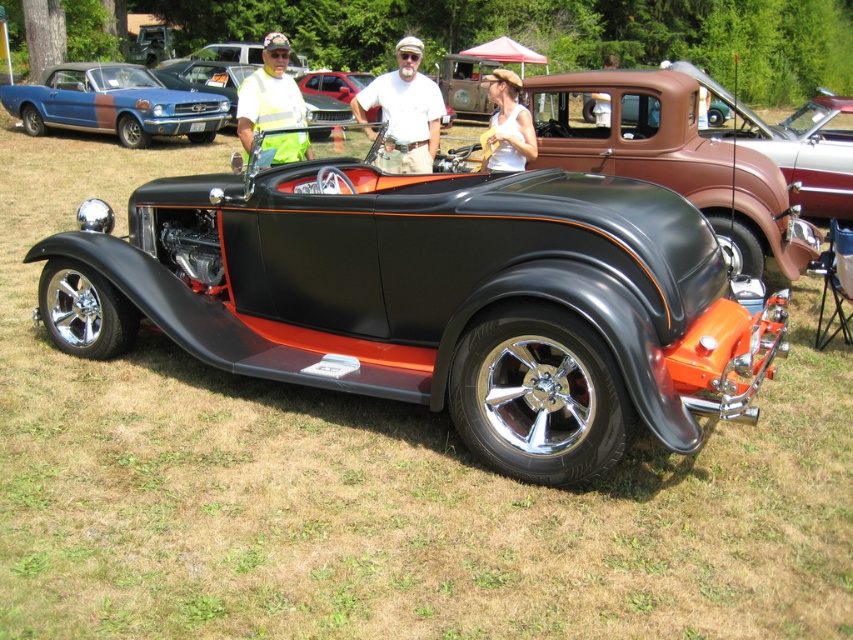
Is point (543, 156) farther from viewer compared to point (96, 120)?

That is False.

Is matte brown pickup truck at center to the left of matte blue and brown car at upper left from the viewer's perspective?

Incorrect, matte brown pickup truck at center is not on the left side of matte blue and brown car at upper left.

The height and width of the screenshot is (640, 853). What are the coordinates of `matte brown pickup truck at center` in the screenshot? It's located at (670, 157).

Based on the photo, can you confirm if matte brown pickup truck at center is wider than matte white tank top at center?

Indeed, matte brown pickup truck at center has a greater width compared to matte white tank top at center.

Which is behind, point (781, 198) or point (521, 136)?

The point (781, 198) is behind.

Find the location of a particular element. Image resolution: width=853 pixels, height=640 pixels. matte brown pickup truck at center is located at coordinates (670, 157).

Does matte brown pickup truck at center have a greater height compared to yellow reflective vest at center?

Indeed, matte brown pickup truck at center has a greater height compared to yellow reflective vest at center.

Is matte brown pickup truck at center thinner than yellow reflective vest at center?

No.

Identify the location of matte brown pickup truck at center. The height and width of the screenshot is (640, 853). (670, 157).

Locate an element on the screen. This screenshot has height=640, width=853. matte brown pickup truck at center is located at coordinates pos(670,157).